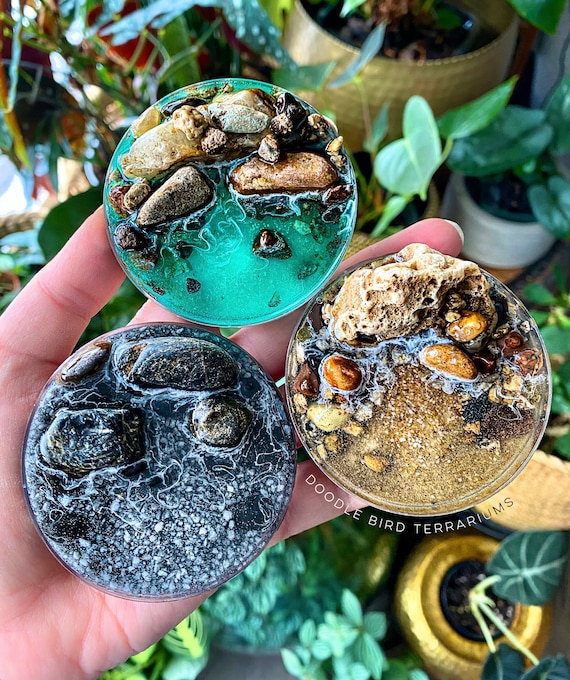
This screenshot has height=680, width=570. Identify the location of pot. (423, 621).